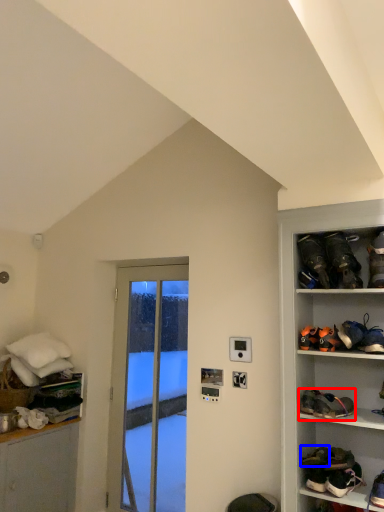
Question: Among these objects, which one is farthest to the camera, footwear (highlighted by a red box) or footwear (highlighted by a blue box)?

Choices:
 (A) footwear
 (B) footwear

Answer: (B)